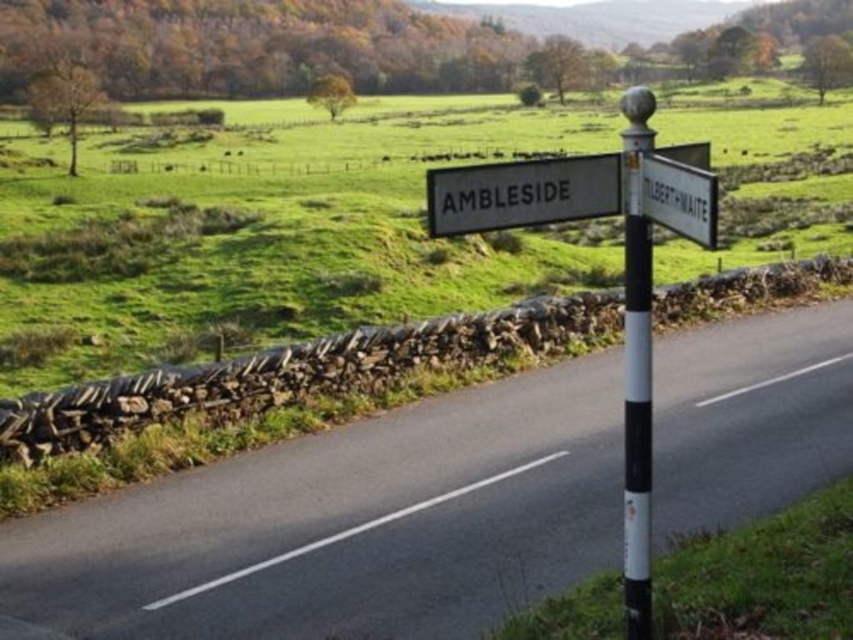
Question: Which point is farther to the camera?

Choices:
 (A) (614, 152)
 (B) (598, 157)
 (C) (631, 173)

Answer: (A)

Question: Can you confirm if black and white striped pole at center-right is smaller than white plastic sign at center?

Choices:
 (A) yes
 (B) no

Answer: (B)

Question: Is white plastic street sign at center wider than white plastic sign at center?

Choices:
 (A) no
 (B) yes

Answer: (B)

Question: Which object is the closest to the black and white striped pole at center-right?

Choices:
 (A) white plastic street sign at center
 (B) white plastic sign at center

Answer: (A)

Question: Is white plastic street sign at center to the left of black and white striped pole at center-right from the viewer's perspective?

Choices:
 (A) yes
 (B) no

Answer: (A)

Question: Which is farther from the white plastic sign at center?

Choices:
 (A) black and white striped pole at center-right
 (B) white plastic street sign at center

Answer: (A)